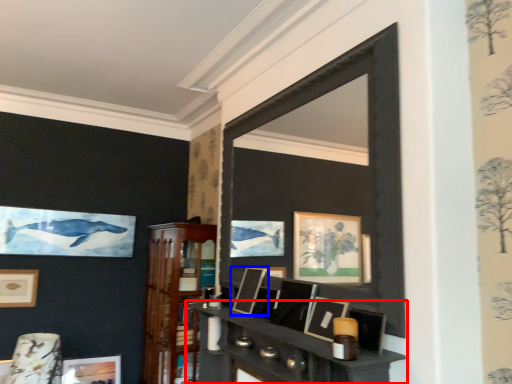
Question: Which point is closer to the camera, shelf (highlighted by a red box) or picture frame (highlighted by a blue box)?

Choices:
 (A) shelf
 (B) picture frame

Answer: (A)